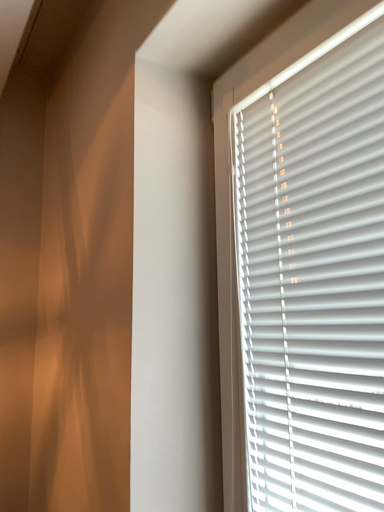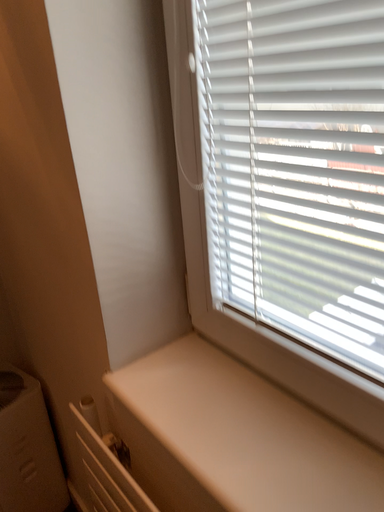
Question: Which way did the camera rotate in the video?

Choices:
 (A) rotated left
 (B) rotated right

Answer: (B)